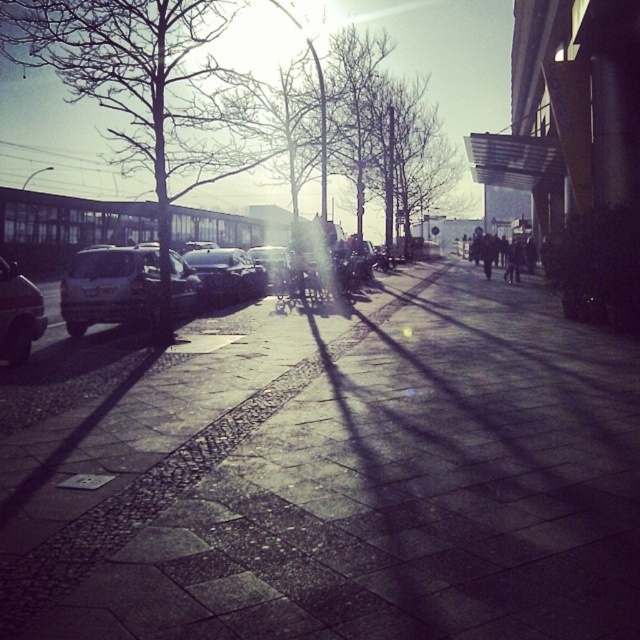
Can you confirm if shiny silver car at center-left is shorter than metallic silver car at center?

In fact, shiny silver car at center-left may be taller than metallic silver car at center.

Does point (250, 291) come farther from viewer compared to point (285, 257)?

No, (250, 291) is in front of (285, 257).

Between point (218, 300) and point (280, 246), which one is positioned in front?

Point (218, 300)

Where is `shiny silver car at center-left`? Image resolution: width=640 pixels, height=640 pixels. shiny silver car at center-left is located at coordinates coord(227,275).

Who is positioned more to the right, matte black car at left or shiny silver car at center-left?

shiny silver car at center-left

Between matte black car at left and shiny silver car at center-left, which one has more height?

Standing taller between the two is shiny silver car at center-left.

The image size is (640, 640). What are the coordinates of `matte black car at left` in the screenshot? It's located at (19, 314).

Find the location of a particular element. This screenshot has width=640, height=640. matte black car at left is located at coordinates (19, 314).

Identify the location of shiny silver car at center-left. This screenshot has width=640, height=640. (227, 275).

How far apart are shiny silver car at center-left and dark clothing figure at center-right?

shiny silver car at center-left and dark clothing figure at center-right are 18.25 meters apart from each other.

Between point (216, 256) and point (504, 252), which one is positioned in front?

Point (216, 256) is in front.

Locate an element on the screen. Image resolution: width=640 pixels, height=640 pixels. shiny silver car at center-left is located at coordinates (227, 275).